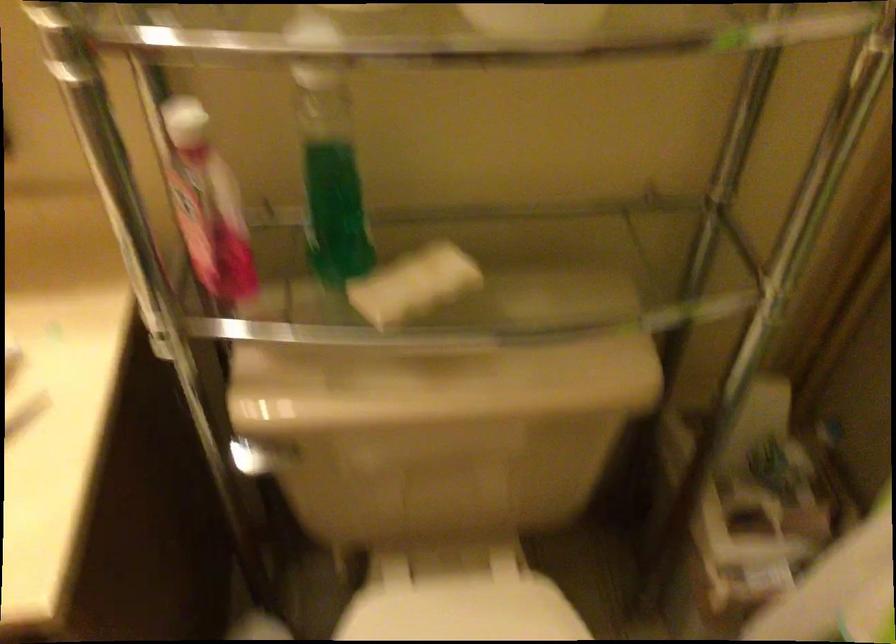
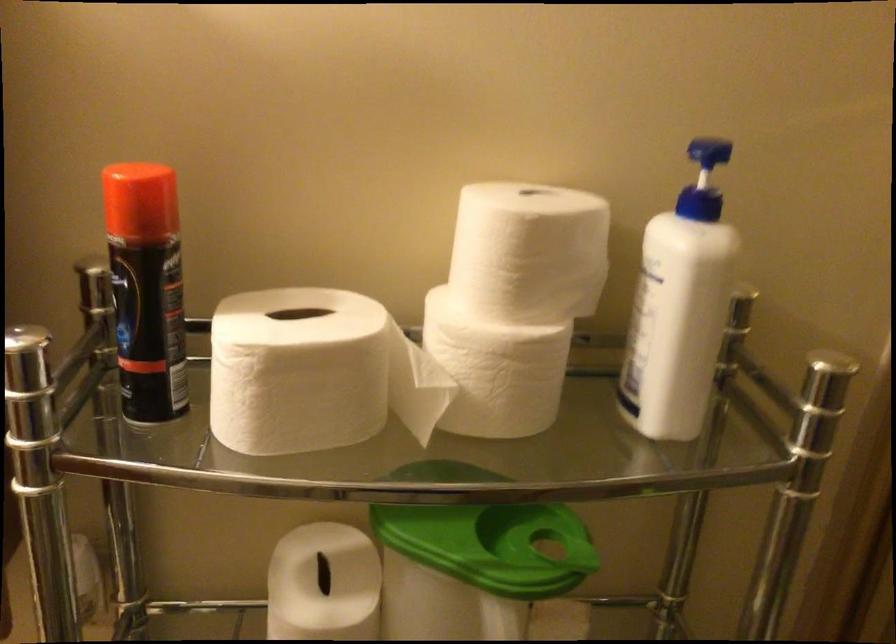
Question: In a continuous first-person perspective shot, in which direction is the camera moving?

Choices:
 (A) Left
 (B) Right
 (C) Forward
 (D) Backward

Answer: (D)